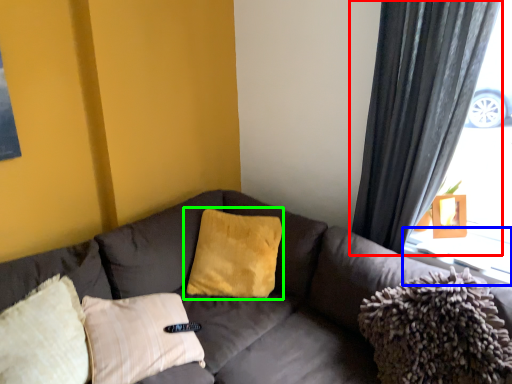
Question: Which is farther away from curtain (highlighted by a red box)? window sill (highlighted by a blue box) or pillow (highlighted by a green box)?

Choices:
 (A) window sill
 (B) pillow

Answer: (B)